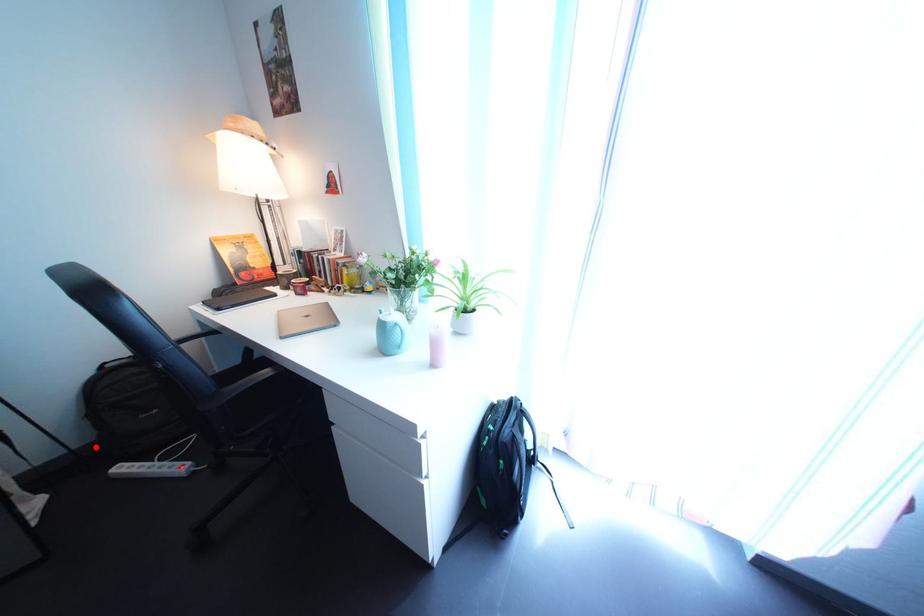
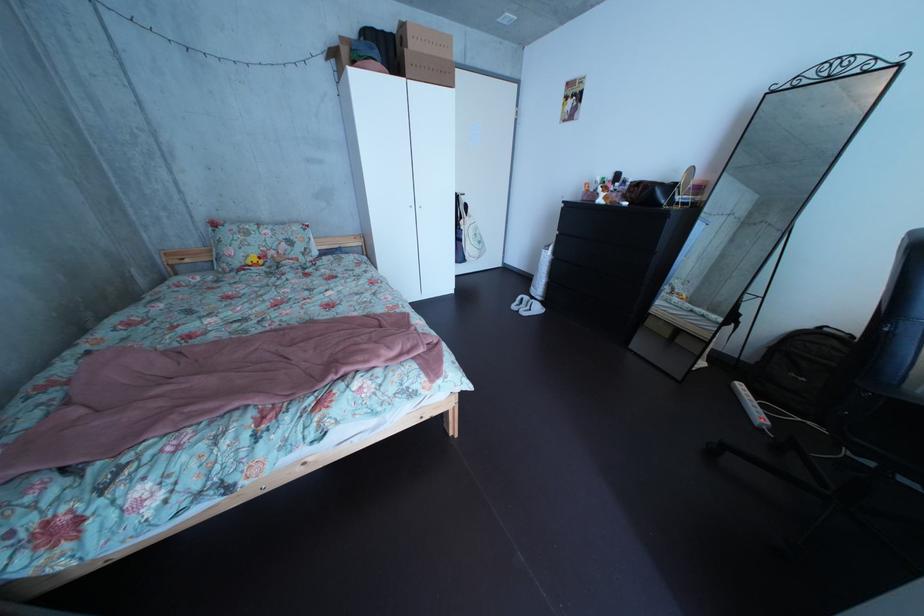
The point at the highlighted location is marked in the first image. Where is the corresponding point in the second image?

(763, 363)